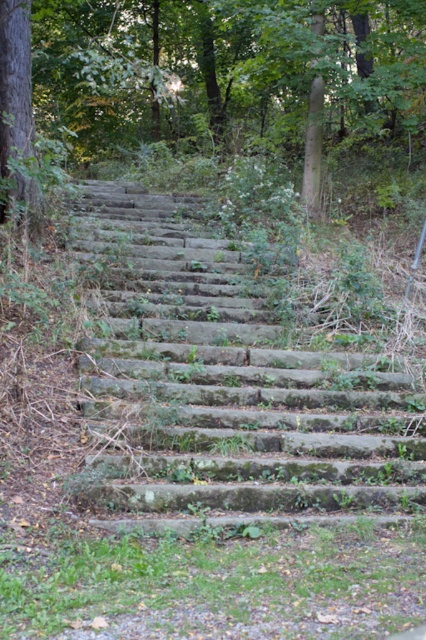
Is green mossy stone stairs at center above green mossy stone steps at center?

Incorrect, green mossy stone stairs at center is not positioned above green mossy stone steps at center.

Who is lower down, green mossy stone stairs at center or green mossy stone steps at center?

green mossy stone stairs at center is lower down.

Does point (354, 520) lie behind point (238, 138)?

No, (354, 520) is closer to viewer.

I want to click on green mossy stone stairs at center, so click(x=226, y=394).